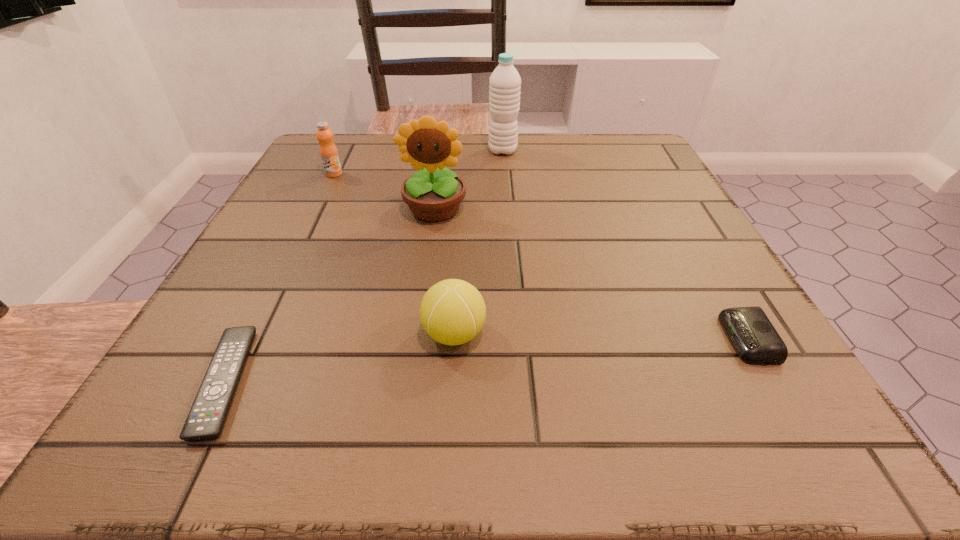
Identify the location of vacant space located 0.320m on the face of the sunflower. (414, 359).

Find the location of `blank space located 0.060m on the front label of the fourth shortest object`. blank space located 0.060m on the front label of the fourth shortest object is located at coordinates (325, 192).

You are a GUI agent. You are given a task and a screenshot of the screen. Output one action in this format:
    pyautogui.click(x=<x>, y=<y>)
    Task: Click on the free location located 0.180m on the left of the fourth tallest object
    
    Given the screenshot: What is the action you would take?
    pyautogui.click(x=302, y=334)

At what (x,y) coordinates should I click in order to perform the action: click on vacant space located 0.250m on the display of the alarm clock. Please return your answer as a coordinate pair (x, y). This screenshot has height=540, width=960. Looking at the image, I should click on (559, 339).

Locate an element on the screen. The image size is (960, 540). blank space located on the display of the alarm clock is located at coordinates click(x=512, y=339).

This screenshot has height=540, width=960. What are the coordinates of `vacant region located on the display of the alarm clock` in the screenshot? It's located at (626, 339).

I want to click on vacant space situated on the back of the shortest object, so click(281, 271).

Find the location of `water bottle at the far edge`. water bottle at the far edge is located at coordinates (505, 83).

I want to click on orange juice present at the far edge, so click(328, 151).

In order to click on object that is positioned at the near edge in this screenshot , I will do `click(205, 421)`.